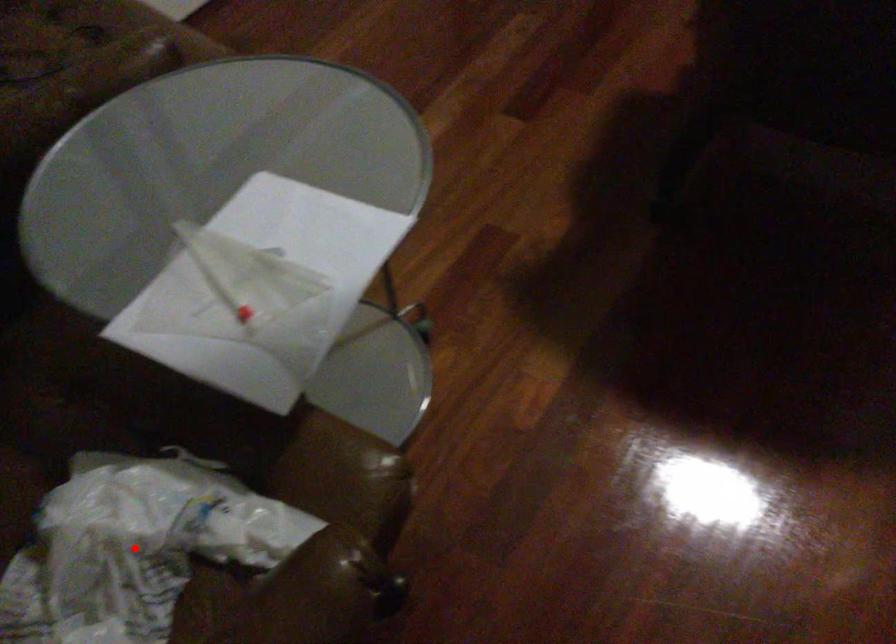
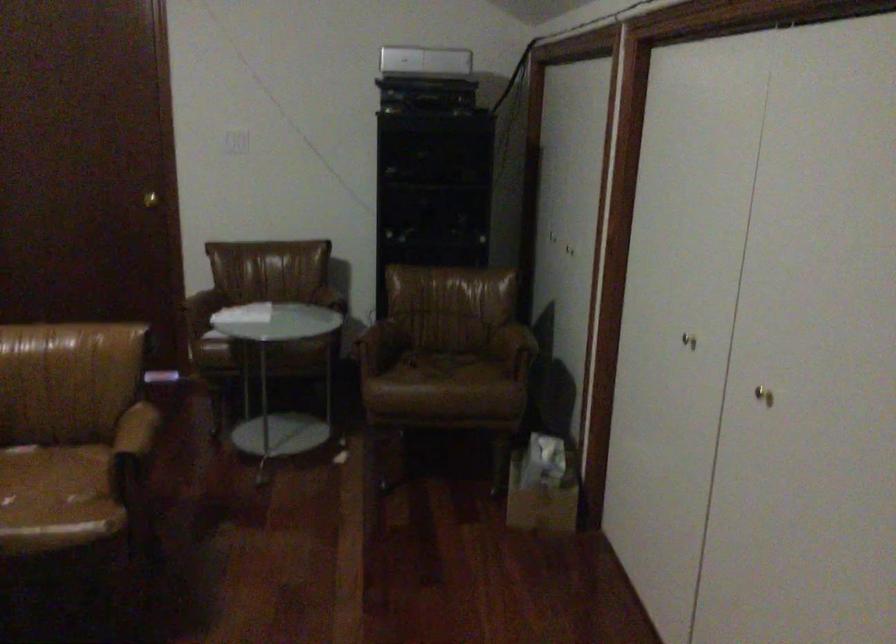
Question: I am providing you with two images of the same scene from different viewpoints. A red point is marked on the first image. Can you still see the location of the red point in image 2?

Choices:
 (A) Yes
 (B) No

Answer: (B)